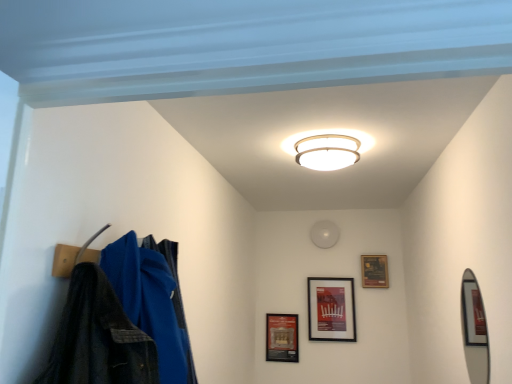
Identify the location of silver metallic mirror at right. (474, 325).

What do you see at coordinates (282, 337) in the screenshot? Image resolution: width=512 pixels, height=384 pixels. I see `matte black picture frame at lower center, the third picture frame in the right-to-left sequence` at bounding box center [282, 337].

What is the approximate height of matte black picture frame at lower center, which ranks as the first picture frame in left-to-right order?

The height of matte black picture frame at lower center, which ranks as the first picture frame in left-to-right order, is 12.98 inches.

The width and height of the screenshot is (512, 384). Find the location of `matte brown picture frame at upper right, the 1th picture frame viewed from the right`. matte brown picture frame at upper right, the 1th picture frame viewed from the right is located at coordinates (374, 271).

Find the location of a particular element. The height and width of the screenshot is (384, 512). silver metallic mirror at right is located at coordinates (474, 325).

Are matte black picture frame at lower center, the third picture frame in the right-to-left sequence, and matte brown picture frame at upper right, the 1th picture frame viewed from the right, making contact?

There is a gap between matte black picture frame at lower center, the third picture frame in the right-to-left sequence, and matte brown picture frame at upper right, the 1th picture frame viewed from the right.

Is matte black picture frame at lower center, the third picture frame in the right-to-left sequence, positioned before matte brown picture frame at upper right, which ranks as the third picture frame in left-to-right order?

No, it is behind matte brown picture frame at upper right, which ranks as the third picture frame in left-to-right order.

Consider the image. From a real-world perspective, between matte black picture frame at lower center, the third picture frame in the right-to-left sequence, and matte brown picture frame at upper right, which ranks as the third picture frame in left-to-right order, who is vertically higher?

matte brown picture frame at upper right, which ranks as the third picture frame in left-to-right order, from a real-world perspective.

Is black matte picture frame at upper center, positioned as the second picture frame in right-to-left order, oriented away from silver metallic mirror at right?

No, black matte picture frame at upper center, positioned as the second picture frame in right-to-left order, is not facing the opposite direction of silver metallic mirror at right.

From a real-world perspective, is black matte picture frame at upper center, positioned as the second picture frame in right-to-left order, on silver metallic mirror at right?

Yes, from a real-world perspective, black matte picture frame at upper center, positioned as the second picture frame in right-to-left order, is on top of silver metallic mirror at right.

Considering the sizes of objects black matte picture frame at upper center, which ranks as the second picture frame in left-to-right order, and silver metallic mirror at right in the image provided, who is smaller, black matte picture frame at upper center, which ranks as the second picture frame in left-to-right order, or silver metallic mirror at right?

silver metallic mirror at right is smaller.

I want to click on picture frame above the black matte picture frame at upper center, which ranks as the second picture frame in left-to-right order (from the image's perspective), so click(x=374, y=271).

Could matte brown picture frame at upper right, which ranks as the third picture frame in left-to-right order, be considered to be inside black matte picture frame at upper center, which ranks as the second picture frame in left-to-right order?

No, matte brown picture frame at upper right, which ranks as the third picture frame in left-to-right order, is not a part of black matte picture frame at upper center, which ranks as the second picture frame in left-to-right order.

In the scene shown: Is black matte picture frame at upper center, which ranks as the second picture frame in left-to-right order, positioned behind matte brown picture frame at upper right, which ranks as the third picture frame in left-to-right order?

No, black matte picture frame at upper center, which ranks as the second picture frame in left-to-right order, is closer to the viewer.

Does point (326, 285) come in front of point (369, 257)?

That is False.

Considering the sizes of silver metallic mirror at right and matte black picture frame at lower center, the third picture frame in the right-to-left sequence, in the image, is silver metallic mirror at right wider or thinner than matte black picture frame at lower center, the third picture frame in the right-to-left sequence,?

In the image, silver metallic mirror at right appears to be more narrow than matte black picture frame at lower center, the third picture frame in the right-to-left sequence.

Measure the distance between silver metallic mirror at right and matte black picture frame at lower center, the third picture frame in the right-to-left sequence.

The distance of silver metallic mirror at right from matte black picture frame at lower center, the third picture frame in the right-to-left sequence, is 1.59 meters.

Is silver metallic mirror at right positioned with its back to matte black picture frame at lower center, which ranks as the first picture frame in left-to-right order?

That's not correct — silver metallic mirror at right is not looking away from matte black picture frame at lower center, which ranks as the first picture frame in left-to-right order.

Considering the positions of point (466, 335) and point (296, 360), is point (466, 335) closer or farther from the camera than point (296, 360)?

Point (466, 335) is positioned closer to the camera compared to point (296, 360).

Who is bigger, matte black picture frame at lower center, the third picture frame in the right-to-left sequence, or black matte picture frame at upper center, positioned as the second picture frame in right-to-left order?

black matte picture frame at upper center, positioned as the second picture frame in right-to-left order, is bigger.

Relative to black matte picture frame at upper center, which ranks as the second picture frame in left-to-right order, is matte black picture frame at lower center, the third picture frame in the right-to-left sequence, in front or behind?

matte black picture frame at lower center, the third picture frame in the right-to-left sequence, is positioned farther from the viewer than black matte picture frame at upper center, which ranks as the second picture frame in left-to-right order.

Can you confirm if matte black picture frame at lower center, the third picture frame in the right-to-left sequence, is taller than black matte picture frame at upper center, which ranks as the second picture frame in left-to-right order?

No.

From the image's perspective, which one is positioned lower, matte black picture frame at lower center, the third picture frame in the right-to-left sequence, or black matte picture frame at upper center, which ranks as the second picture frame in left-to-right order?

From the image's view, matte black picture frame at lower center, the third picture frame in the right-to-left sequence, is below.

From a real-world perspective, is matte brown picture frame at upper right, the 1th picture frame viewed from the right, positioned above or below matte black picture frame at lower center, which ranks as the first picture frame in left-to-right order?

From a real-world perspective, matte brown picture frame at upper right, the 1th picture frame viewed from the right, is physically above matte black picture frame at lower center, which ranks as the first picture frame in left-to-right order.

From the image's perspective, is matte brown picture frame at upper right, which ranks as the third picture frame in left-to-right order, positioned above or below matte black picture frame at lower center, which ranks as the first picture frame in left-to-right order?

Based on their image positions, matte brown picture frame at upper right, which ranks as the third picture frame in left-to-right order, is located above matte black picture frame at lower center, which ranks as the first picture frame in left-to-right order.

Does matte brown picture frame at upper right, which ranks as the third picture frame in left-to-right order, have a greater height compared to matte black picture frame at lower center, which ranks as the first picture frame in left-to-right order?

In fact, matte brown picture frame at upper right, which ranks as the third picture frame in left-to-right order, may be shorter than matte black picture frame at lower center, which ranks as the first picture frame in left-to-right order.

From a real-world perspective, which picture frame is the 2nd one above the matte black picture frame at lower center, which ranks as the first picture frame in left-to-right order? Please provide its 2D coordinates.

[(374, 271)]

Considering the positions of objects white glossy ceiling light at center and matte black picture frame at lower center, the third picture frame in the right-to-left sequence, in the image provided, who is more to the left, white glossy ceiling light at center or matte black picture frame at lower center, the third picture frame in the right-to-left sequence,?

matte black picture frame at lower center, the third picture frame in the right-to-left sequence.

Considering the sizes of objects white glossy ceiling light at center and matte black picture frame at lower center, which ranks as the first picture frame in left-to-right order, in the image provided, who is bigger, white glossy ceiling light at center or matte black picture frame at lower center, which ranks as the first picture frame in left-to-right order,?

white glossy ceiling light at center is bigger.

From the image's perspective, is white glossy ceiling light at center located above matte black picture frame at lower center, the third picture frame in the right-to-left sequence?

Correct, white glossy ceiling light at center appears higher than matte black picture frame at lower center, the third picture frame in the right-to-left sequence, in the image.

Which is behind, point (301, 133) or point (270, 346)?

Point (270, 346)

At what (x,y) coordinates should I click in order to perform the action: click on picture frame that is the 2nd object directly below the matte brown picture frame at upper right, which ranks as the third picture frame in left-to-right order (from a real-world perspective). Please return your answer as a coordinate pair (x, y). The height and width of the screenshot is (384, 512). Looking at the image, I should click on (282, 337).

Image resolution: width=512 pixels, height=384 pixels. I want to click on the 1st picture frame above the silver metallic mirror at right (from a real-world perspective), so click(331, 309).

When comparing their distances from matte black picture frame at lower center, which ranks as the first picture frame in left-to-right order, does silver metallic mirror at right or black matte picture frame at upper center, positioned as the second picture frame in right-to-left order, seem closer?

Based on the image, black matte picture frame at upper center, positioned as the second picture frame in right-to-left order, appears to be nearer to matte black picture frame at lower center, which ranks as the first picture frame in left-to-right order.

Looking at the image, which one is located further to silver metallic mirror at right, white glossy ceiling light at center or matte brown picture frame at upper right, the 1th picture frame viewed from the right?

matte brown picture frame at upper right, the 1th picture frame viewed from the right.

Considering their positions, is silver metallic mirror at right positioned further to matte brown picture frame at upper right, the 1th picture frame viewed from the right, than black matte picture frame at upper center, which ranks as the second picture frame in left-to-right order?

silver metallic mirror at right is positioned further to the anchor matte brown picture frame at upper right, the 1th picture frame viewed from the right.

Based on the photo, looking at the image, which one is located further to white glossy ceiling light at center, matte black picture frame at lower center, the third picture frame in the right-to-left sequence, or silver metallic mirror at right?

The object further to white glossy ceiling light at center is matte black picture frame at lower center, the third picture frame in the right-to-left sequence.

Which object lies further to the anchor point silver metallic mirror at right, matte brown picture frame at upper right, which ranks as the third picture frame in left-to-right order, or white glossy ceiling light at center?

matte brown picture frame at upper right, which ranks as the third picture frame in left-to-right order, is further to silver metallic mirror at right.

Looking at the image, which one is located further to silver metallic mirror at right, matte black picture frame at lower center, the third picture frame in the right-to-left sequence, or matte brown picture frame at upper right, which ranks as the third picture frame in left-to-right order?

matte black picture frame at lower center, the third picture frame in the right-to-left sequence, is positioned further to the anchor silver metallic mirror at right.

Which object lies nearer to the anchor point silver metallic mirror at right, matte black picture frame at lower center, the third picture frame in the right-to-left sequence, or white glossy ceiling light at center?

white glossy ceiling light at center is closer to silver metallic mirror at right.

Looking at the image, which one is located closer to matte brown picture frame at upper right, the 1th picture frame viewed from the right, black matte picture frame at upper center, which ranks as the second picture frame in left-to-right order, or silver metallic mirror at right?

black matte picture frame at upper center, which ranks as the second picture frame in left-to-right order, lies closer to matte brown picture frame at upper right, the 1th picture frame viewed from the right, than the other object.

You are a GUI agent. You are given a task and a screenshot of the screen. Output one action in this format:
    pyautogui.click(x=<x>, y=<y>)
    Task: Click on the picture frame between silver metallic mirror at right and matte brown picture frame at upper right, the 1th picture frame viewed from the right, from front to back
    
    Given the screenshot: What is the action you would take?
    pyautogui.click(x=331, y=309)

The width and height of the screenshot is (512, 384). In order to click on picture frame positioned between white glossy ceiling light at center and matte brown picture frame at upper right, the 1th picture frame viewed from the right, from near to far in this screenshot , I will do `click(331, 309)`.

At what (x,y) coordinates should I click in order to perform the action: click on lamp between silver metallic mirror at right and matte brown picture frame at upper right, the 1th picture frame viewed from the right, in the front-back direction. Please return your answer as a coordinate pair (x, y). The height and width of the screenshot is (384, 512). Looking at the image, I should click on (327, 151).

Where is `picture frame situated between matte black picture frame at lower center, the third picture frame in the right-to-left sequence, and matte brown picture frame at upper right, the 1th picture frame viewed from the right, from left to right`? picture frame situated between matte black picture frame at lower center, the third picture frame in the right-to-left sequence, and matte brown picture frame at upper right, the 1th picture frame viewed from the right, from left to right is located at coordinates (331, 309).